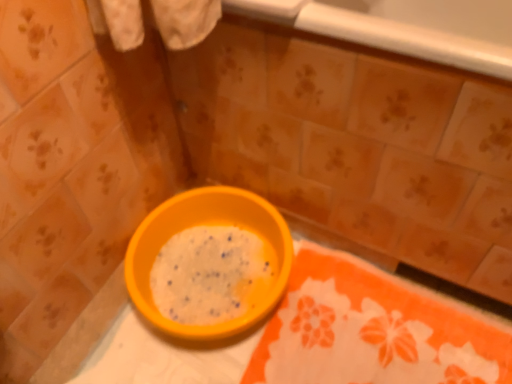
Question: From the image's perspective, relative to orange plastic bowl at center, is orange fabric tablecloth at lower right above or below?

Choices:
 (A) above
 (B) below

Answer: (B)

Question: In the image, is orange fabric tablecloth at lower right on the left side or the right side of orange plastic bowl at center?

Choices:
 (A) right
 (B) left

Answer: (A)

Question: In terms of size, does orange fabric tablecloth at lower right appear bigger or smaller than orange plastic bowl at center?

Choices:
 (A) small
 (B) big

Answer: (A)

Question: Is orange plastic bowl at center taller or shorter than orange fabric tablecloth at lower right?

Choices:
 (A) short
 (B) tall

Answer: (B)

Question: Is orange plastic bowl at center inside the boundaries of orange fabric tablecloth at lower right, or outside?

Choices:
 (A) inside
 (B) outside

Answer: (B)

Question: Relative to orange fabric tablecloth at lower right, is orange plastic bowl at center in front or behind?

Choices:
 (A) front
 (B) behind

Answer: (B)

Question: Looking at their shapes, would you say orange plastic bowl at center is wider or thinner than orange fabric tablecloth at lower right?

Choices:
 (A) wide
 (B) thin

Answer: (B)